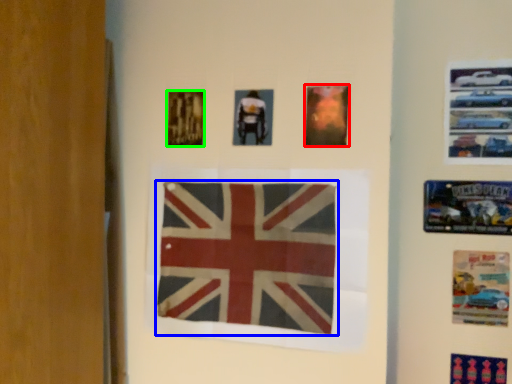
Question: Which object is the farthest from poster (highlighted by a red box)? Choose among these: flag (highlighted by a blue box) or poster (highlighted by a green box).

Choices:
 (A) flag
 (B) poster

Answer: (B)